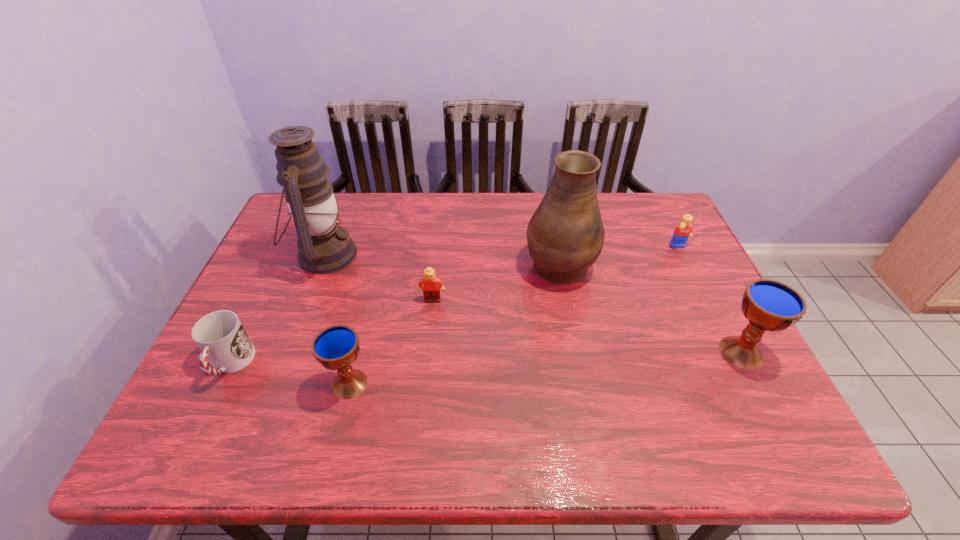
Image resolution: width=960 pixels, height=540 pixels. I want to click on the shorter chalice, so click(x=336, y=347).

This screenshot has width=960, height=540. In order to click on the left chalice in this screenshot , I will do `click(336, 347)`.

Find the location of `the taller chalice`. the taller chalice is located at coordinates (769, 305).

Locate an element on the screen. Image resolution: width=960 pixels, height=540 pixels. the fifth shortest object is located at coordinates (769, 305).

Where is `oil lamp`? The width and height of the screenshot is (960, 540). oil lamp is located at coordinates (324, 247).

Find the location of `the nearer Lego`. the nearer Lego is located at coordinates (431, 290).

Identify the location of the left Lego. (431, 290).

Where is `the fifth object from left to right`? The height and width of the screenshot is (540, 960). the fifth object from left to right is located at coordinates (565, 235).

This screenshot has width=960, height=540. I want to click on the second tallest object, so click(565, 235).

Locate an element on the screen. The height and width of the screenshot is (540, 960). cup is located at coordinates (223, 341).